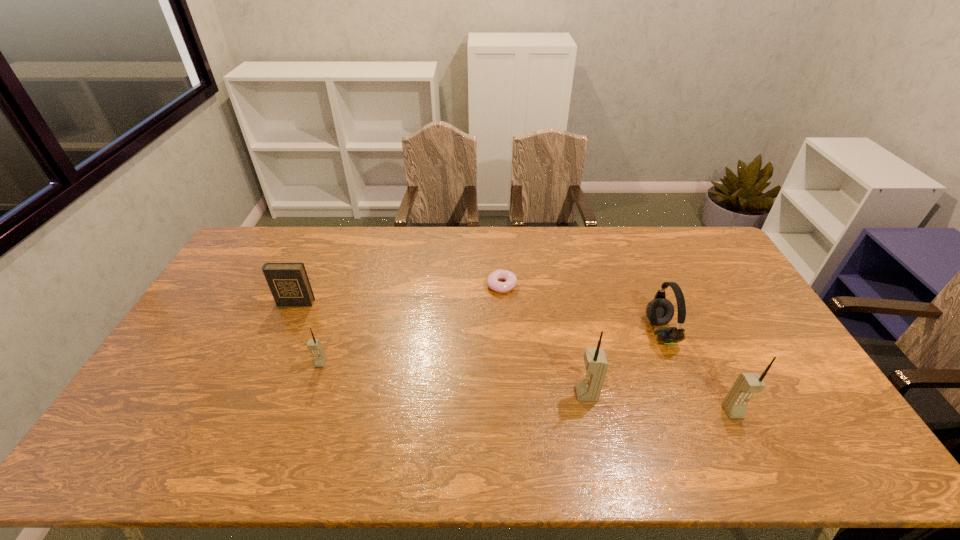
If we want them evenly spaced by inserting an extra cellular_telephone among them, please locate a free spot for this new cellular_telephone. Please provide its 2D coordinates. Your answer should be formatted as a tuple, i.e. [(x, y)], where the tuple contains the x and y coordinates of a point satisfying the conditions above.

[(449, 378)]